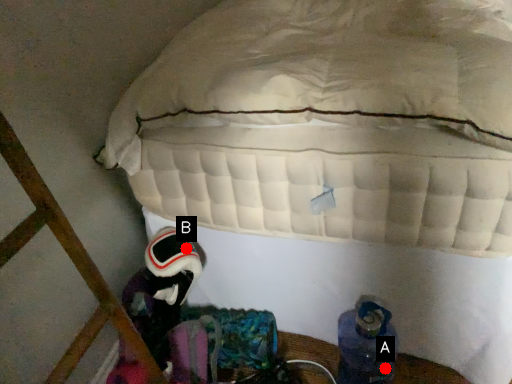
Question: Two points are circled on the image, labeled by A and B beside each circle. Which of the following is the closest to the observer?

Choices:
 (A) A is closer
 (B) B is closer

Answer: (A)